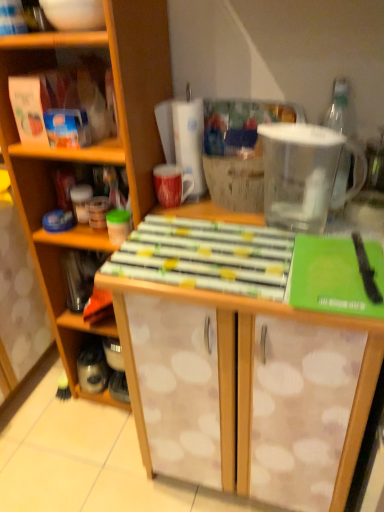
I want to click on vacant space to the left of white dotted wood cabinet at center, so click(47, 421).